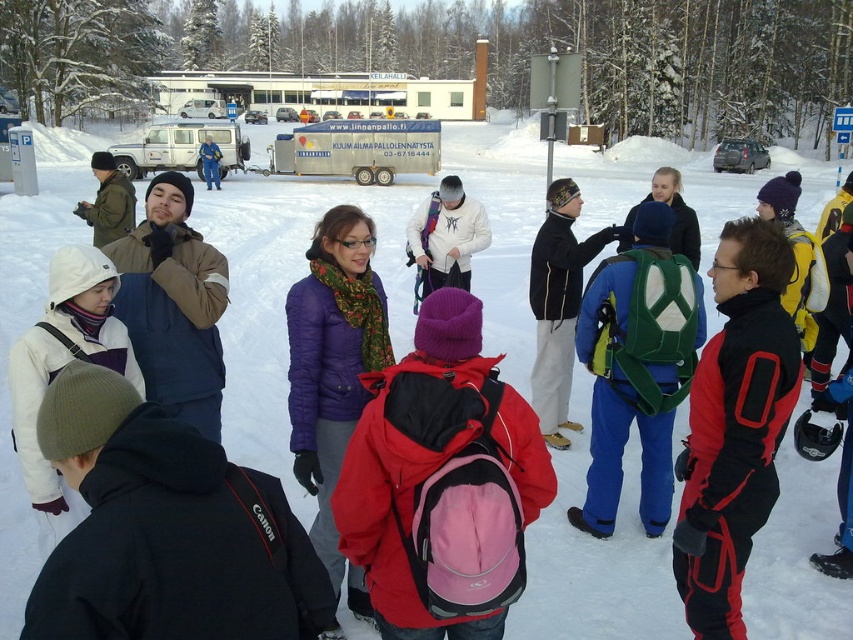
You are standing in the snowy area and want to determine which jacket is taller between the matte green jacket at center and the blue denim jacket at center. Based on the scene, which one is taller?

The matte green jacket at center is taller than the blue denim jacket at center.